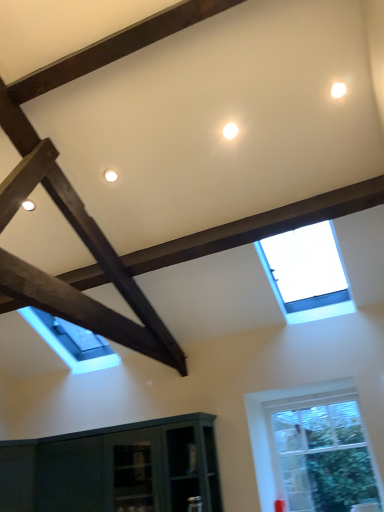
Question: Looking at their shapes, would you say clear glass window at lower right, the second window in the top-to-bottom sequence, is wider or thinner than transparent glass skylight at upper center, which is the second window in bottom-to-top order?

Choices:
 (A) thin
 (B) wide

Answer: (A)

Question: From a real-world perspective, is clear glass window at lower right, the second window in the top-to-bottom sequence, physically located above or below transparent glass skylight at upper center, which is the second window in bottom-to-top order?

Choices:
 (A) above
 (B) below

Answer: (B)

Question: From the image's perspective, relative to transparent glass skylight at upper center, the 1th window from the top, is clear glass window at lower right, which is the 1th window in bottom-to-top order, above or below?

Choices:
 (A) above
 (B) below

Answer: (B)

Question: In terms of width, does transparent glass skylight at upper center, which is the second window in bottom-to-top order, look wider or thinner when compared to clear glass window at lower right, the second window in the top-to-bottom sequence?

Choices:
 (A) thin
 (B) wide

Answer: (B)

Question: Is transparent glass skylight at upper center, which is the second window in bottom-to-top order, to the left or to the right of clear glass window at lower right, the second window in the top-to-bottom sequence, in the image?

Choices:
 (A) left
 (B) right

Answer: (A)

Question: Considering the positions of point (319, 289) and point (276, 445), is point (319, 289) closer or farther from the camera than point (276, 445)?

Choices:
 (A) closer
 (B) farther

Answer: (A)

Question: From a real-world perspective, is transparent glass skylight at upper center, the 1th window from the top, above or below clear glass window at lower right, which is the 1th window in bottom-to-top order?

Choices:
 (A) above
 (B) below

Answer: (A)